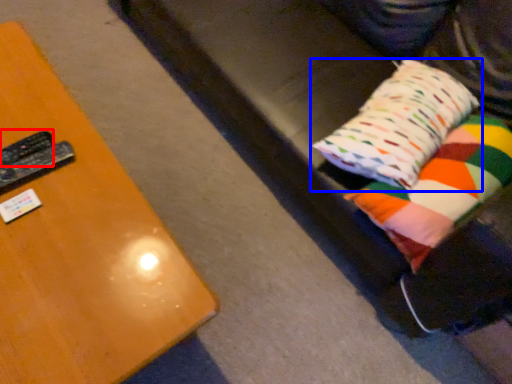
Question: Among these objects, which one is farthest to the camera, remote (highlighted by a red box) or pillow (highlighted by a blue box)?

Choices:
 (A) remote
 (B) pillow

Answer: (A)